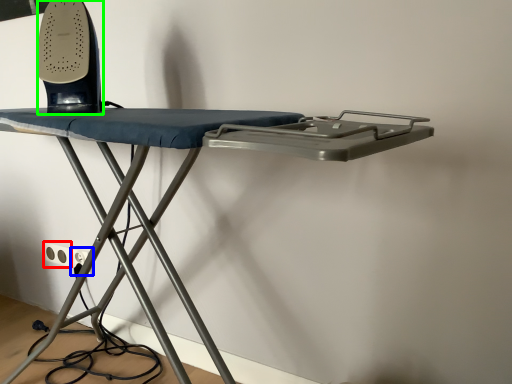
Question: Which object is the closest to the electric outlet (highlighted by a red box)? Choose among these: electric outlet (highlighted by a blue box) or equipment (highlighted by a green box).

Choices:
 (A) electric outlet
 (B) equipment

Answer: (A)